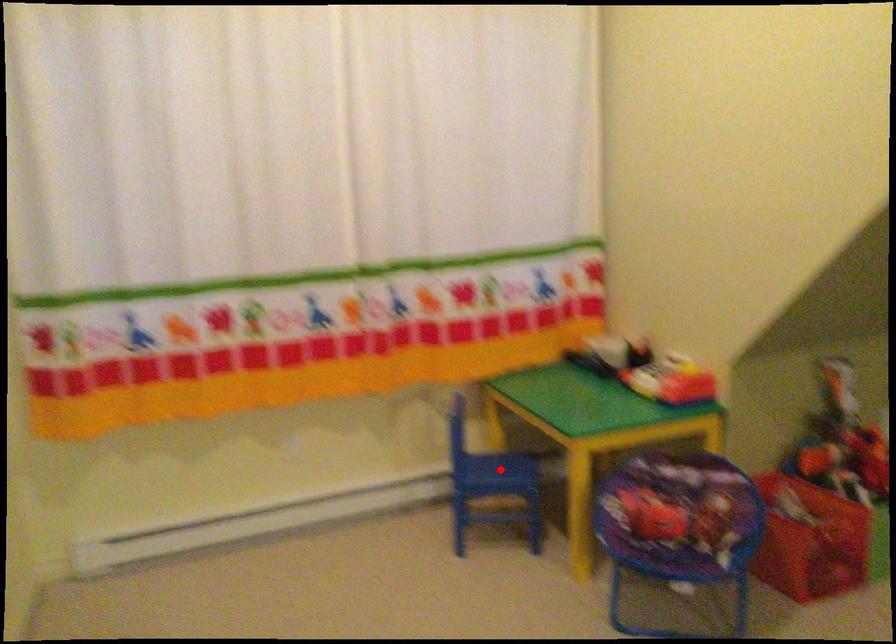
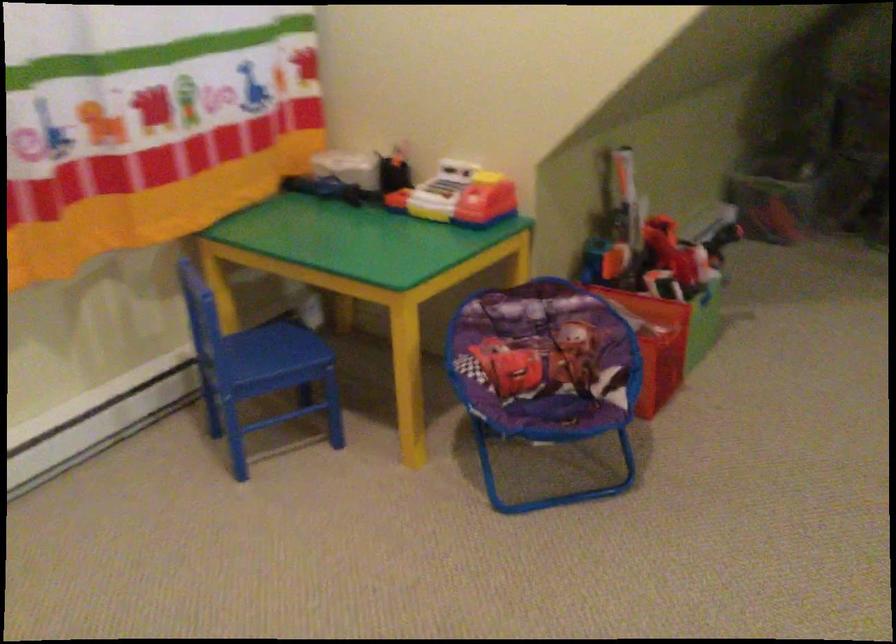
Question: I am providing you with two images of the same scene from different viewpoints. In image1, a red point is highlighted. Considering the same 3D point in image2, which of the following is correct?

Choices:
 (A) It is closer
 (B) It is farther

Answer: (A)